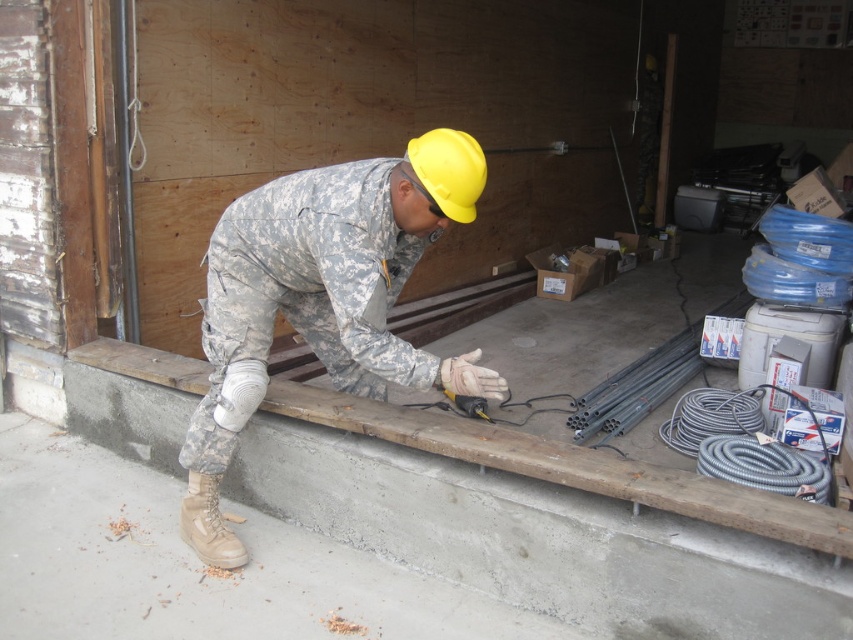
How far apart are camouflage uniform at center and wooden plank at center?

17.36 inches

Can you confirm if camouflage uniform at center is smaller than wooden plank at center?

No, camouflage uniform at center is not smaller than wooden plank at center.

This screenshot has width=853, height=640. What do you see at coordinates (322, 298) in the screenshot?
I see `camouflage uniform at center` at bounding box center [322, 298].

In order to click on camouflage uniform at center in this screenshot , I will do `click(322, 298)`.

Can you confirm if gray concrete at lower left is positioned to the right of camouflage uniform at center?

Incorrect, gray concrete at lower left is not on the right side of camouflage uniform at center.

Identify the location of gray concrete at lower left. This screenshot has height=640, width=853. (196, 564).

Is camouflage uniform at center bigger than yellow plastic drill at center?

Yes, camouflage uniform at center is bigger than yellow plastic drill at center.

Who is positioned more to the left, camouflage uniform at center or yellow plastic drill at center?

camouflage uniform at center is more to the left.

Between point (403, 161) and point (489, 419), which one is positioned behind?

Point (489, 419)

At what (x,y) coordinates should I click in order to perform the action: click on camouflage uniform at center. Please return your answer as a coordinate pair (x, y). This screenshot has width=853, height=640. Looking at the image, I should click on (322, 298).